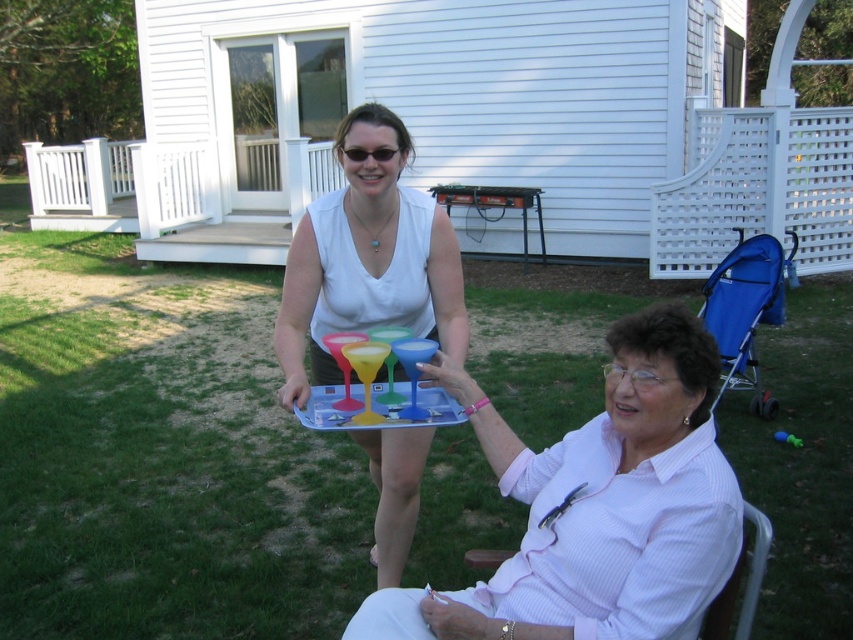
You are a delivery drone trying to deliver a package to the sliding glass door on the porch. The transparent plastic tray at center is blocking your path. Can you fly over it?

The transparent plastic tray at center is located at point (161,456), so yes, the drone can fly over it since it is positioned lower than the drone flight path.

Consider the image. You are a bartender preparing drinks and notice the transparent plastic tray at center and the pink matte plastic glasses at center. Which object is located above the other?

The transparent plastic tray at center is positioned over the pink matte plastic glasses at center, so the tray is above the glasses.

You are a guest at a backyard gathering and see the pink matte plastic glasses at center. Where exactly are they positioned in relation to the other items in the scene?

The pink matte plastic glasses at center are located at coordinates point (368,257), which places them centrally within the scene, likely on the tray being held by the standing person.